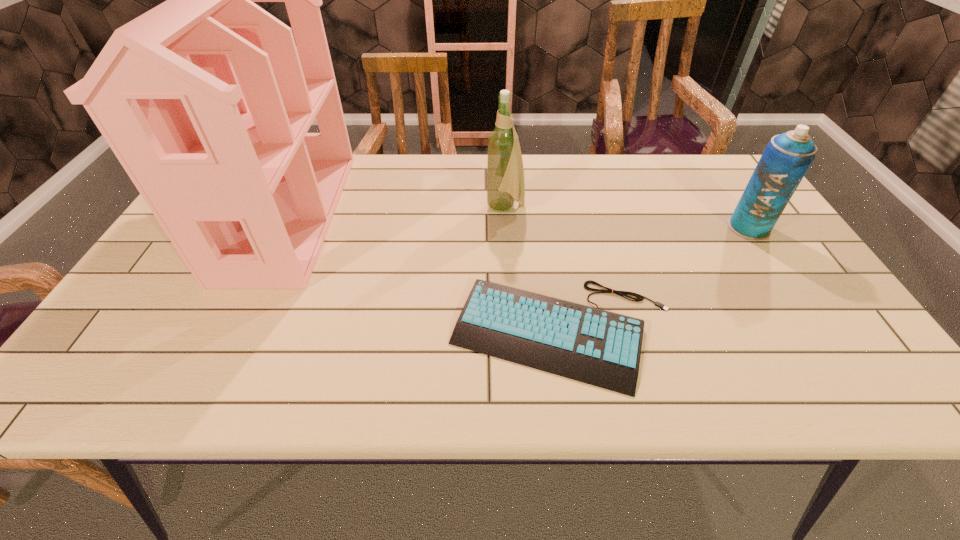
The height and width of the screenshot is (540, 960). What are the coordinates of `blank area located on the left of the rightmost object` in the screenshot? It's located at (642, 228).

This screenshot has width=960, height=540. Find the location of `free spot located on the back of the shortest object`. free spot located on the back of the shortest object is located at coordinates (545, 220).

Identify the location of dollhouse present at the far edge. The image size is (960, 540). (206, 101).

The image size is (960, 540). I want to click on wine bottle at the far edge, so click(505, 173).

The width and height of the screenshot is (960, 540). I want to click on object that is positioned at the near edge, so click(x=597, y=347).

Where is `object that is at the left edge`? This screenshot has height=540, width=960. object that is at the left edge is located at coordinates 206,101.

The width and height of the screenshot is (960, 540). I want to click on object that is at the right edge, so click(x=787, y=157).

Locate an element on the screen. Image resolution: width=960 pixels, height=540 pixels. object located in the far left corner section of the desktop is located at coordinates (206, 101).

This screenshot has width=960, height=540. What are the coordinates of `free space at the far edge of the desktop` in the screenshot? It's located at (638, 188).

Locate an element on the screen. vacant space at the near edge of the desktop is located at coordinates (250, 385).